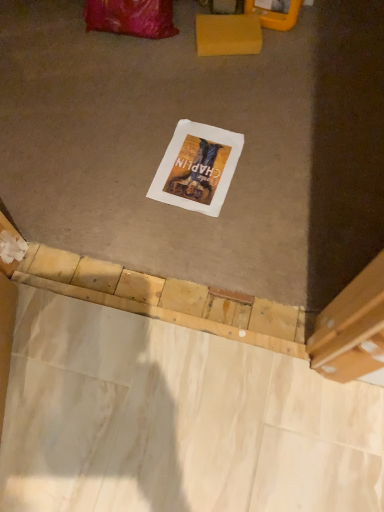
Image resolution: width=384 pixels, height=512 pixels. What do you see at coordinates (197, 168) in the screenshot?
I see `white paper flyer at center` at bounding box center [197, 168].

Where is `white paper flyer at center`? white paper flyer at center is located at coordinates (197, 168).

The height and width of the screenshot is (512, 384). Identify the location of white paper flyer at center. (197, 168).